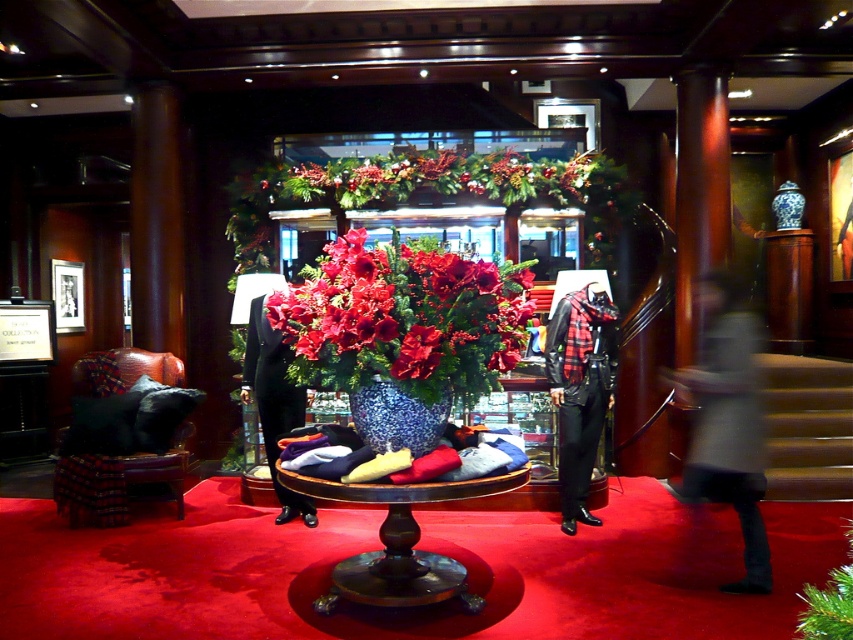
You are a customer entering the store and want to sit down to rest. You see the leather armchair at lower left and the wooden stairs at right. Which one is shorter and more suitable for sitting?

The leather armchair at lower left is shorter than the wooden stairs at right, making it more suitable for sitting.

You are a delivery person who needs to place a new rectangular box that is 1 meter wide onto the glossy ceramic vase at center or the wooden stairs at right. Based on the scene description, which object can the box fit on?

The glossy ceramic vase at center is thinner than wooden stairs at right. Since the box is 1 meter wide, it can only fit on the wooden stairs at right which has a wider base.